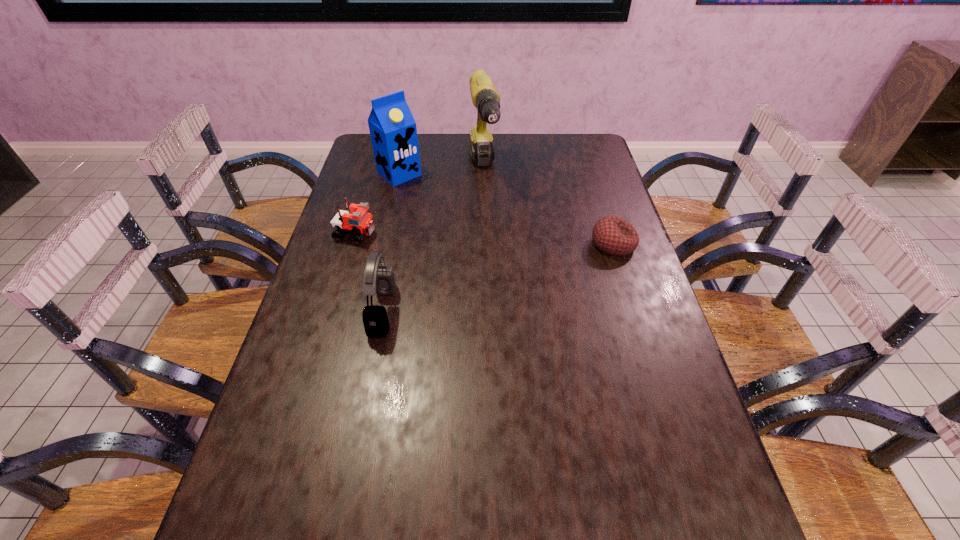
Locate an element on the screen. The height and width of the screenshot is (540, 960). vacant point located between the shortest object and the second shortest object is located at coordinates (485, 239).

Locate an element on the screen. free space between the carton and the drill is located at coordinates (442, 173).

This screenshot has width=960, height=540. In order to click on vacant space in between the rightmost object and the headset in this screenshot , I will do `click(498, 278)`.

The height and width of the screenshot is (540, 960). I want to click on vacant space in between the second object from right to left and the rightmost object, so click(548, 208).

The width and height of the screenshot is (960, 540). What are the coordinates of `vacant area that lies between the fourth tallest object and the shortest object` in the screenshot? It's located at (485, 239).

Find the location of a particular element. This screenshot has height=540, width=960. vacant space that is in between the fourth tallest object and the drill is located at coordinates (420, 203).

I want to click on the fourth closest object relative to the Lego, so click(612, 235).

The width and height of the screenshot is (960, 540). Identify the location of object that can be found as the fourth closest to the headset. (612, 235).

This screenshot has height=540, width=960. Find the location of `free space that satisfies the following two spatial constraints: 1. on the front side of the carton; 2. on the left side of the shortest object`. free space that satisfies the following two spatial constraints: 1. on the front side of the carton; 2. on the left side of the shortest object is located at coordinates (383, 244).

Image resolution: width=960 pixels, height=540 pixels. Identify the location of vacant region that satisfies the following two spatial constraints: 1. on the front side of the second shortest object; 2. on the right side of the shortest object. (352, 244).